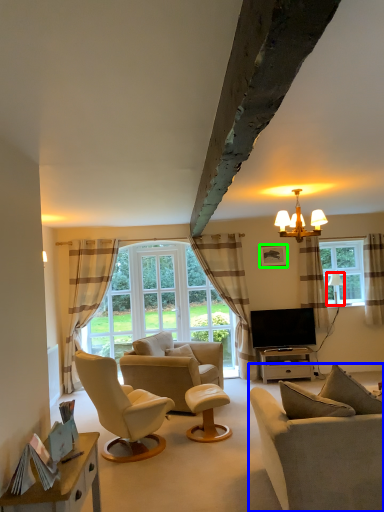
Question: Based on their relative distances, which object is farther from lamp (highlighted by a red box)? Choose from studio couch (highlighted by a blue box) and picture frame (highlighted by a green box).

Choices:
 (A) studio couch
 (B) picture frame

Answer: (A)